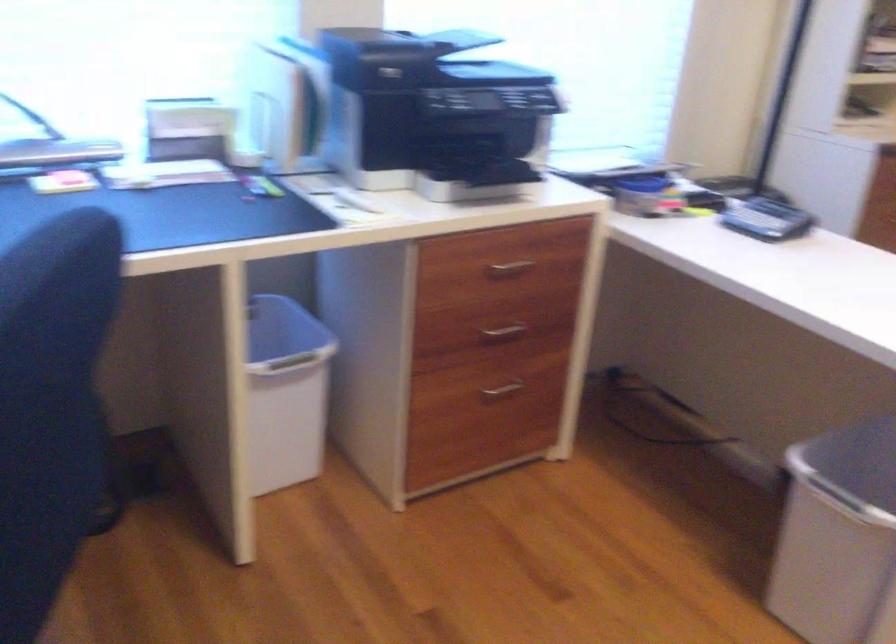
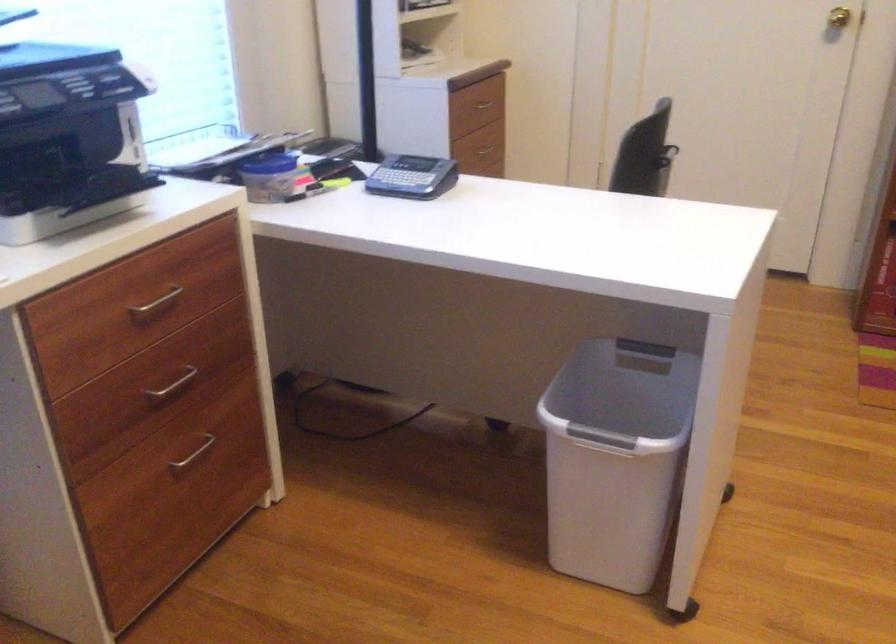
Question: The camera is either moving clockwise (left) or counter-clockwise (right) around the object. The first image is from the beginning of the video and the second image is from the end. Is the camera moving left or right when shooting the video?

Choices:
 (A) Left
 (B) Right

Answer: (A)